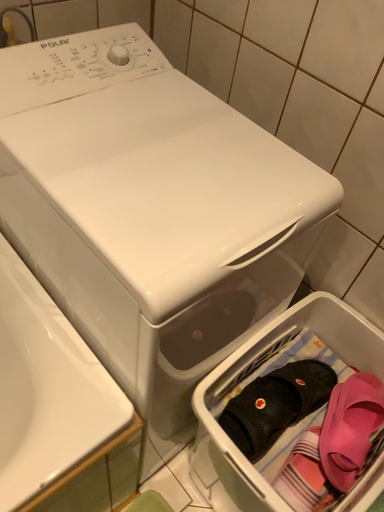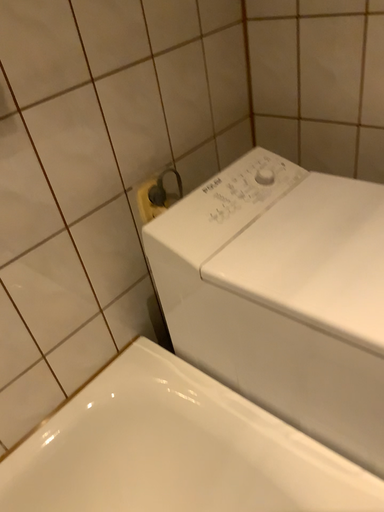
Question: Which way did the camera rotate in the video?

Choices:
 (A) rotated right
 (B) rotated left

Answer: (B)